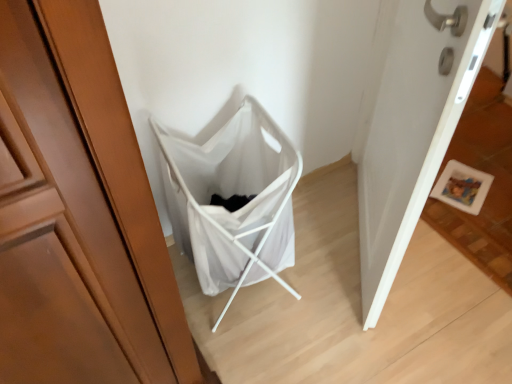
This screenshot has height=384, width=512. Identify the location of unoccupied region to the right of white fabric laundry basket at center. (327, 284).